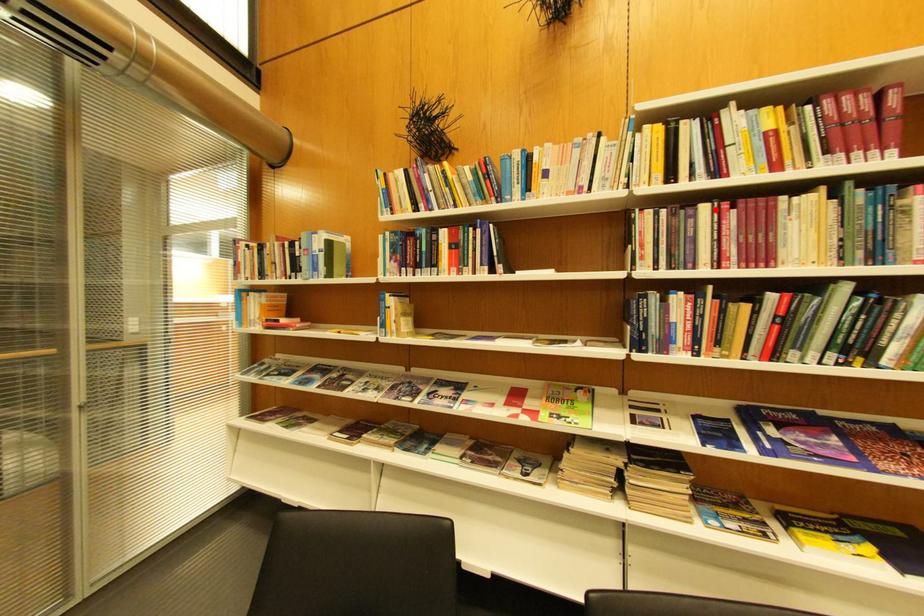
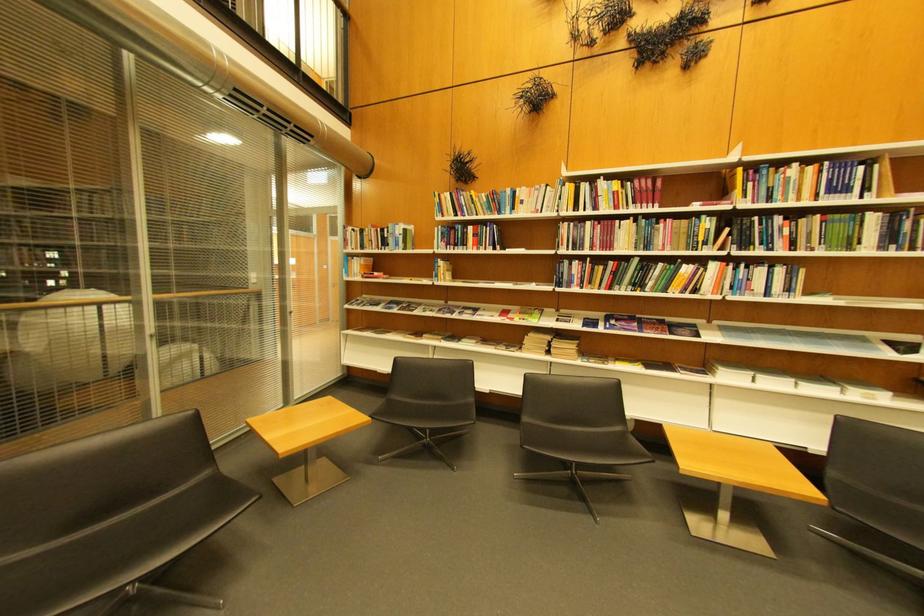
The point at the highlighted location is marked in the first image. Where is the corresponding point in the second image?

(600, 225)